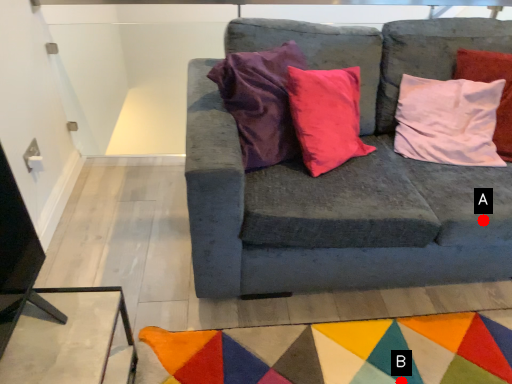
Question: Two points are circled on the image, labeled by A and B beside each circle. Which point is closer to the camera?

Choices:
 (A) A is closer
 (B) B is closer

Answer: (B)